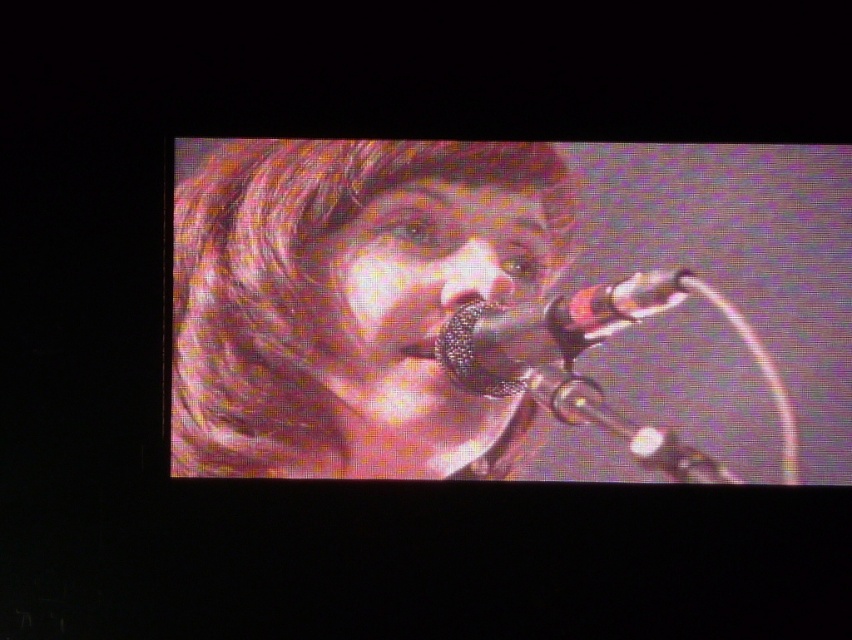
Is shiny black microphone at center above metallic mesh microphone at center?

Correct, shiny black microphone at center is located above metallic mesh microphone at center.

Is shiny black microphone at center shorter than metallic mesh microphone at center?

In fact, shiny black microphone at center may be taller than metallic mesh microphone at center.

Which is behind, point (482, 262) or point (455, 378)?

The point (455, 378) is behind.

Where is `shiny black microphone at center`? Image resolution: width=852 pixels, height=640 pixels. shiny black microphone at center is located at coordinates (352, 301).